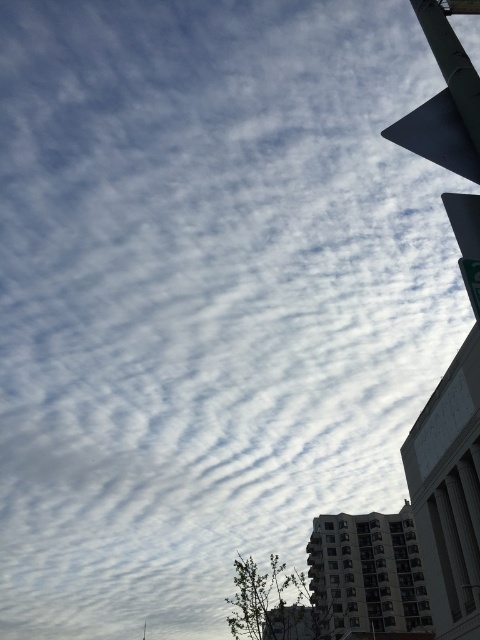
Is green matte traffic light at upper right smaller than green metallic pole at upper right?

No.

Is green matte traffic light at upper right wider than green metallic pole at upper right?

Correct, the width of green matte traffic light at upper right exceeds that of green metallic pole at upper right.

I want to click on green matte traffic light at upper right, so click(x=437, y=134).

At what (x,y) coordinates should I click in order to perform the action: click on green matte traffic light at upper right. Please return your answer as a coordinate pair (x, y). Image resolution: width=480 pixels, height=640 pixels. Looking at the image, I should click on (437, 134).